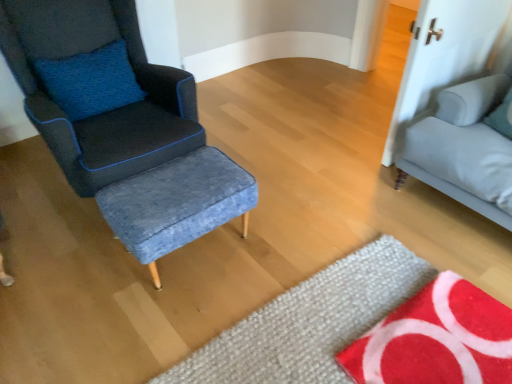
Find the location of a particular element. Image resolution: width=512 pixels, height=384 pixels. vacant space that is to the left of denim fabric stool at center is located at coordinates (74, 268).